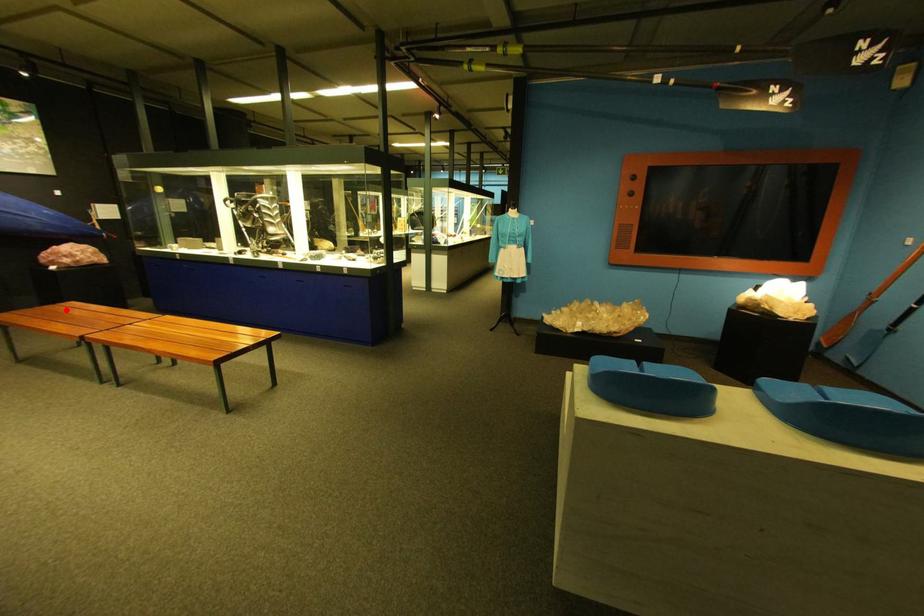
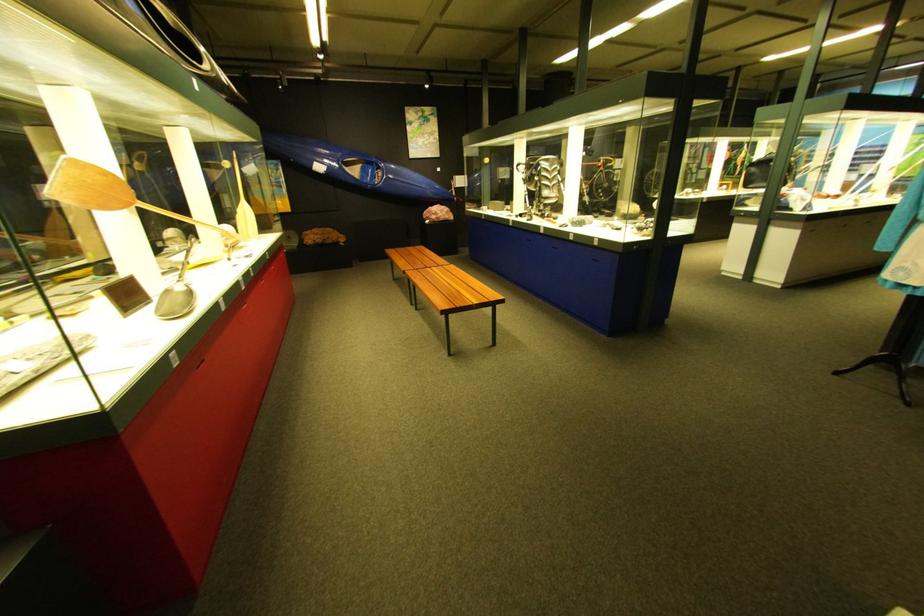
In the second image, find the point that corresponds to the highlighted location in the first image.

(427, 251)